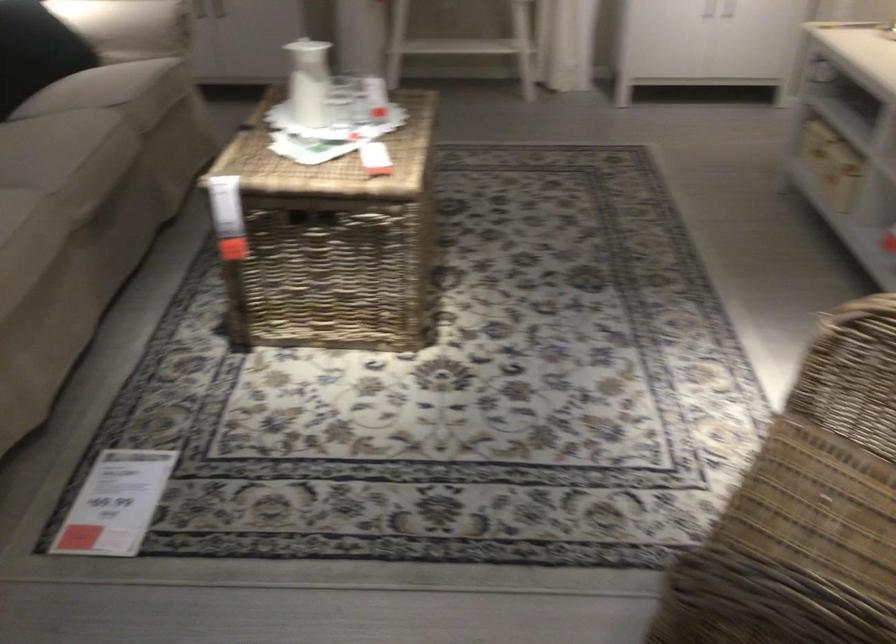
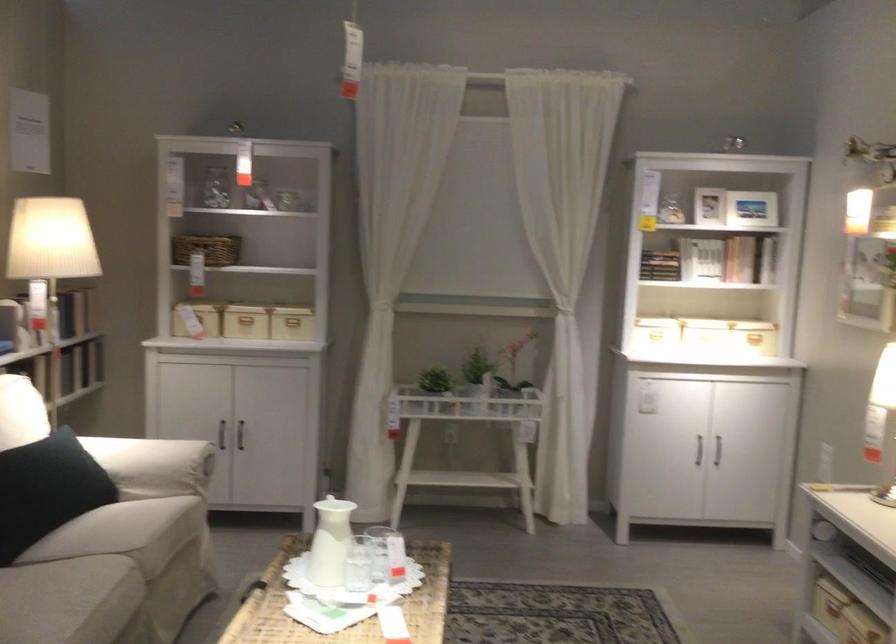
Where in the second image is the point corresponding to (366,89) from the first image?

(386, 554)